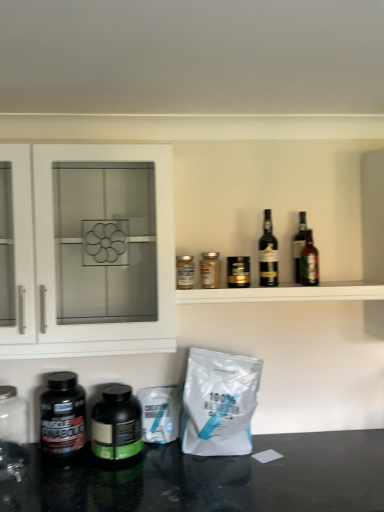
This screenshot has width=384, height=512. What are the coordinates of `spots to the right of dark glass bottle at upper right, the fifth bottle in the left-to-right sequence` in the screenshot? It's located at (309, 287).